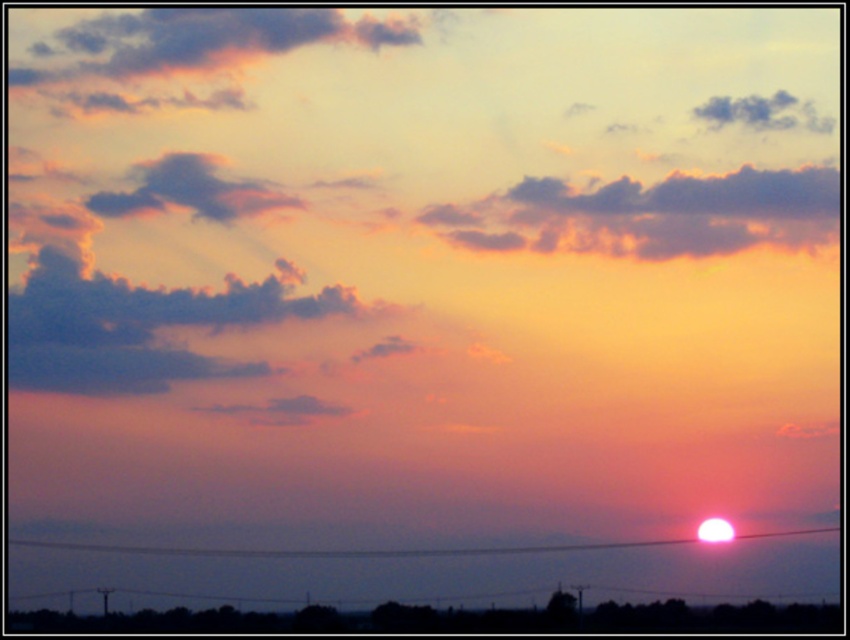
You are an astronomer observing the sunset. You notice a point at coordinates point (x=649, y=214). What celestial object is located at that point?

At point (x=649, y=214), there are cloudy textured clouds at upper center.